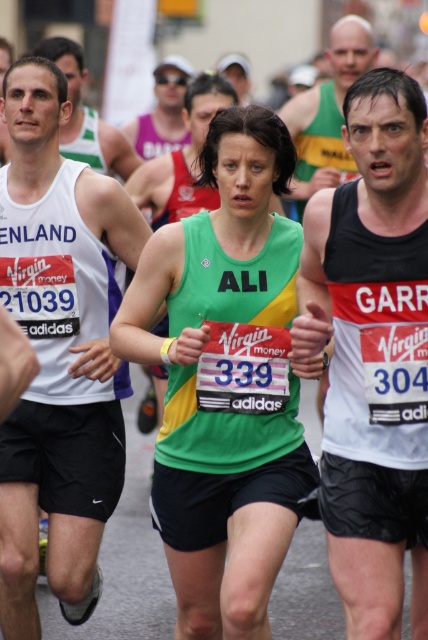
Consider the image. Does white matte tank top at left appear under green jersey at center?

Yes, white matte tank top at left is below green jersey at center.

Can you confirm if white matte tank top at left is positioned to the left of green jersey at center?

Correct, you'll find white matte tank top at left to the left of green jersey at center.

Find the location of a particular element. Image resolution: width=428 pixels, height=640 pixels. white matte tank top at left is located at coordinates (94, 296).

Locate an element on the screen. Image resolution: width=428 pixels, height=640 pixels. white matte tank top at left is located at coordinates (94, 296).

Is green/yellow fabric tank top at center closer to the viewer compared to matte purple tank top at upper center?

Yes.

Locate an element on the screen. green/yellow fabric tank top at center is located at coordinates (225, 372).

Is point (199, 593) behind point (177, 90)?

No.

Image resolution: width=428 pixels, height=640 pixels. Find the location of `green/yellow fabric tank top at center`. green/yellow fabric tank top at center is located at coordinates (225, 372).

Who is more distant from viewer, (121, 152) or (168, 56)?

The point (168, 56) is more distant.

Is point (109, 131) positioned behind point (172, 84)?

No, (109, 131) is closer to viewer.

Image resolution: width=428 pixels, height=640 pixels. What are the coordinates of `white tank top at center` in the screenshot? It's located at (86, 116).